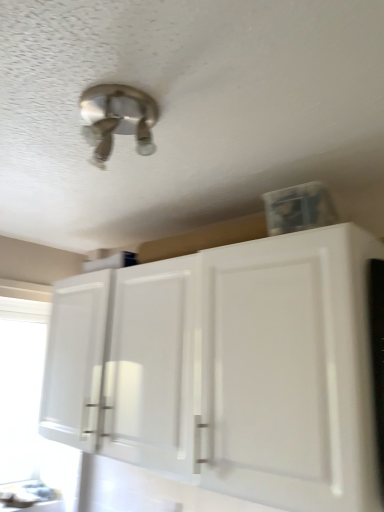
Question: In terms of size, does transparent plastic window screen at left appear bigger or smaller than satin nickel light fixture at upper center?

Choices:
 (A) big
 (B) small

Answer: (A)

Question: Is transparent plastic window screen at left wider or thinner than satin nickel light fixture at upper center?

Choices:
 (A) wide
 (B) thin

Answer: (B)

Question: Which of these objects is positioned closest to the transparent plastic window screen at left?

Choices:
 (A) white glossy cabinet at lower right
 (B) satin nickel light fixture at upper center

Answer: (A)

Question: Which of these objects is positioned closest to the satin nickel light fixture at upper center?

Choices:
 (A) transparent plastic window screen at left
 (B) white glossy cabinet at lower right

Answer: (B)